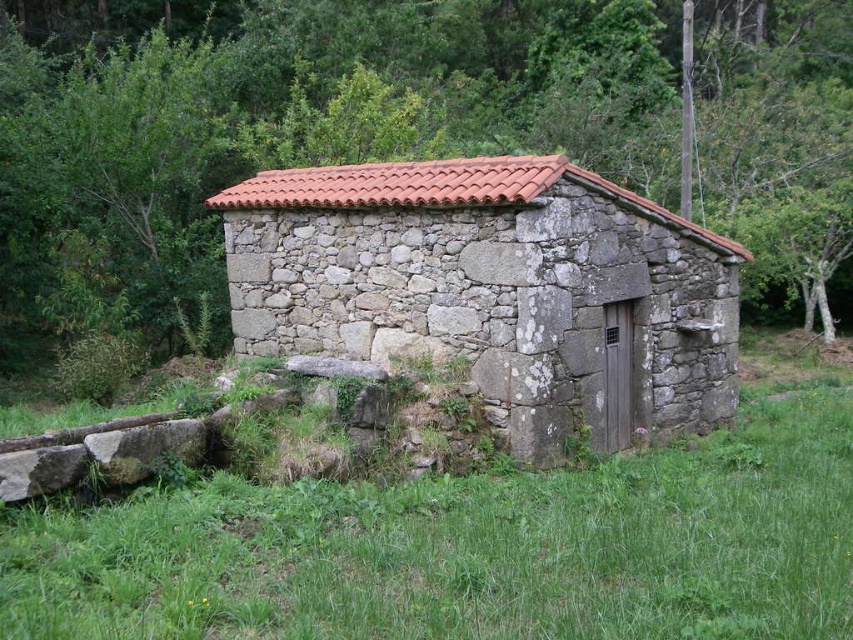
Which of these two, stone textured hut at center or green leafy tree at upper left, stands taller?

With more height is stone textured hut at center.

Who is positioned more to the right, stone textured hut at center or green leafy tree at upper left?

Positioned to the right is stone textured hut at center.

This screenshot has width=853, height=640. Identify the location of stone textured hut at center. (495, 289).

Which is more to the right, green leafy tree at center or stone textured hut at center?

Positioned to the right is green leafy tree at center.

Locate an element on the screen. green leafy tree at center is located at coordinates (286, 108).

Locate an element on the screen. The height and width of the screenshot is (640, 853). green leafy tree at center is located at coordinates (286, 108).

Does green leafy tree at center have a lesser width compared to green leafy tree at upper left?

In fact, green leafy tree at center might be wider than green leafy tree at upper left.

At what (x,y) coordinates should I click in order to perform the action: click on green leafy tree at center. Please return your answer as a coordinate pair (x, y). Looking at the image, I should click on (286, 108).

Identify the location of green leafy tree at center. (286, 108).